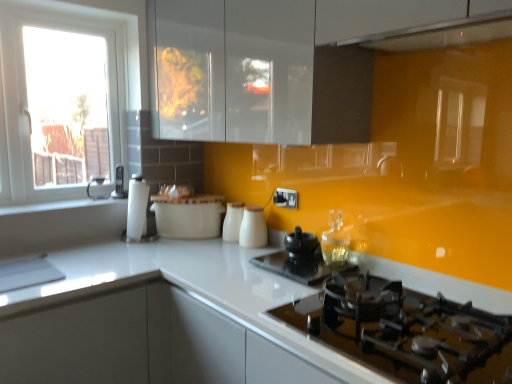
Question: Is white glossy cabinet at lower left surrounding white ceramic bowl at center, which is counted as the third kitchen appliance, starting from the right?

Choices:
 (A) no
 (B) yes

Answer: (A)

Question: Can you confirm if white glossy cabinet at lower left is smaller than white ceramic bowl at center, the first kitchen appliance when ordered from left to right?

Choices:
 (A) no
 (B) yes

Answer: (A)

Question: Does white glossy cabinet at lower left turn towards white ceramic bowl at center, the first kitchen appliance when ordered from left to right?

Choices:
 (A) no
 (B) yes

Answer: (A)

Question: Is white glossy cabinet at lower left at the right side of white ceramic bowl at center, which is counted as the third kitchen appliance, starting from the right?

Choices:
 (A) no
 (B) yes

Answer: (A)

Question: Considering the relative sizes of white glossy cabinet at lower left and white ceramic bowl at center, the first kitchen appliance when ordered from left to right, in the image provided, is white glossy cabinet at lower left bigger than white ceramic bowl at center, the first kitchen appliance when ordered from left to right,?

Choices:
 (A) yes
 (B) no

Answer: (A)

Question: Looking at the image, does white ceramic bowl at center, the first kitchen appliance when ordered from left to right, seem bigger or smaller compared to matte black kettle at left, the 3th appliance viewed from the front?

Choices:
 (A) big
 (B) small

Answer: (A)

Question: Is white ceramic bowl at center, which is counted as the third kitchen appliance, starting from the right, in front of or behind matte black kettle at left, the first appliance in the back-to-front sequence, in the image?

Choices:
 (A) front
 (B) behind

Answer: (A)

Question: Looking at their shapes, would you say white ceramic bowl at center, the first kitchen appliance when ordered from left to right, is wider or thinner than matte black kettle at left, acting as the 3th appliance starting from the bottom?

Choices:
 (A) thin
 (B) wide

Answer: (B)

Question: Is white ceramic bowl at center, which is counted as the third kitchen appliance, starting from the right, inside the boundaries of matte black kettle at left, acting as the 3th appliance starting from the bottom, or outside?

Choices:
 (A) inside
 (B) outside

Answer: (B)

Question: Would you say white glossy window at left is to the left or to the right of black ceramic kettle at center, marked as the 2th appliance in a bottom-to-top arrangement, in the picture?

Choices:
 (A) right
 (B) left

Answer: (B)

Question: In the image, is white glossy window at left positioned in front of or behind black ceramic kettle at center, which ranks as the first appliance in right-to-left order?

Choices:
 (A) behind
 (B) front

Answer: (A)

Question: Is white glossy window at left spatially inside black ceramic kettle at center, which appears as the second appliance when viewed from the top, or outside of it?

Choices:
 (A) inside
 (B) outside

Answer: (B)

Question: Based on their sizes in the image, would you say white glossy window at left is bigger or smaller than black ceramic kettle at center, which appears as the second appliance when viewed from the top?

Choices:
 (A) big
 (B) small

Answer: (A)

Question: Is white glossy milk jugs at center, which is counted as the second kitchen appliance, starting from the left, in front of or behind matte black kettle at left, the first appliance in the back-to-front sequence, in the image?

Choices:
 (A) behind
 (B) front

Answer: (B)

Question: From the image's perspective, is white glossy milk jugs at center, the second kitchen appliance in the right-to-left sequence, located above or below matte black kettle at left, the first appliance in the back-to-front sequence?

Choices:
 (A) above
 (B) below

Answer: (B)